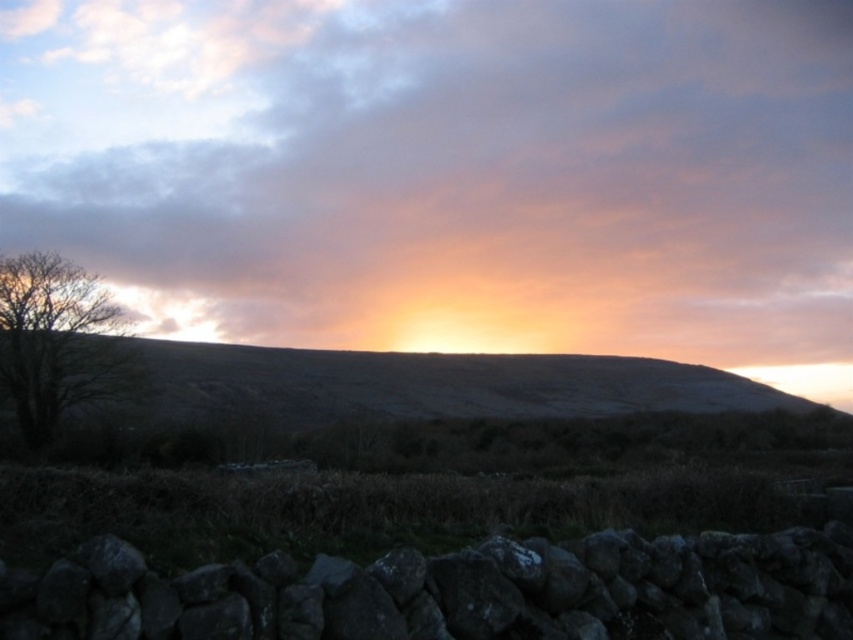
Question: Which point appears farthest from the camera in this image?

Choices:
 (A) (74, 355)
 (B) (300, 336)

Answer: (B)

Question: Which object appears closest to the camera in this image?

Choices:
 (A) brown leafless tree at left
 (B) cloudy sky at upper center

Answer: (A)

Question: From the image, what is the correct spatial relationship of cloudy sky at upper center in relation to brown leafless tree at left?

Choices:
 (A) right
 (B) left

Answer: (A)

Question: Is cloudy sky at upper center to the right of brown leafless tree at left from the viewer's perspective?

Choices:
 (A) yes
 (B) no

Answer: (A)

Question: Is cloudy sky at upper center to the right of brown leafless tree at left from the viewer's perspective?

Choices:
 (A) no
 (B) yes

Answer: (B)